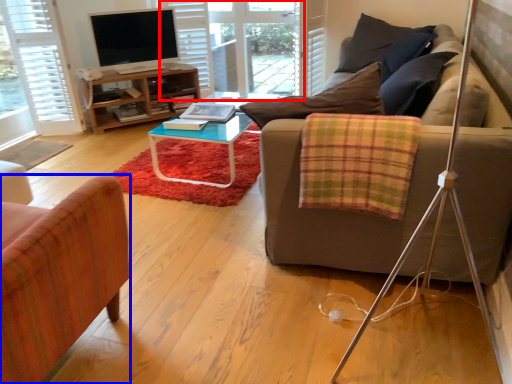
Question: Which of the following is the farthest to the observer, glass door (highlighted by a red box) or chair (highlighted by a blue box)?

Choices:
 (A) glass door
 (B) chair

Answer: (A)